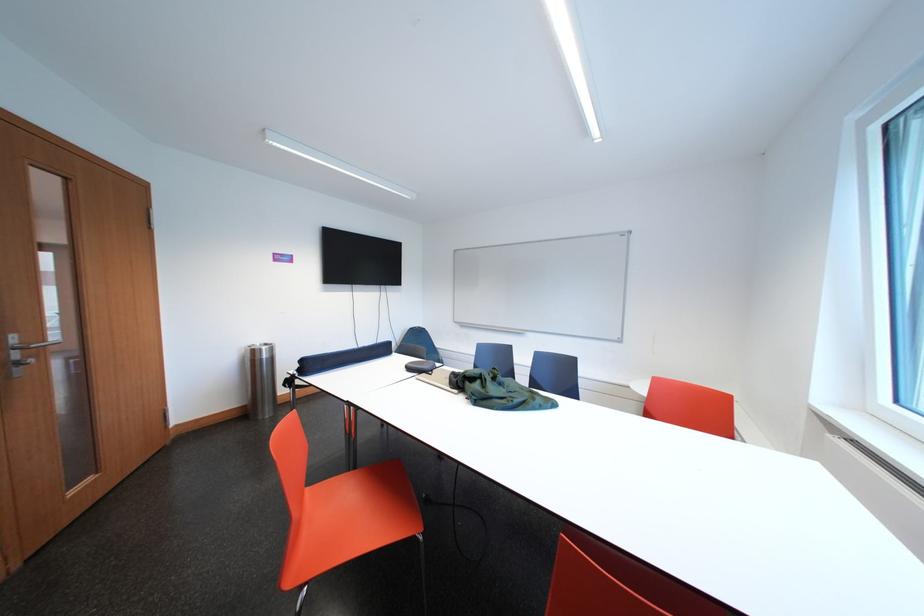
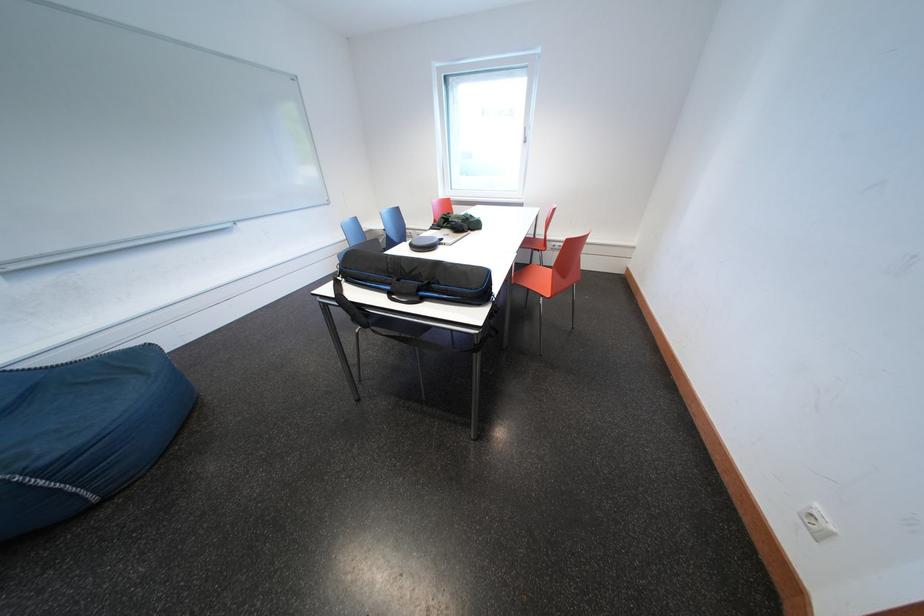
Question: I am providing you with two images of the same scene from different viewpoints. Please identify which objects are invisible in image2.

Choices:
 (A) whiteboard marker tray
 (B) large brown bottle
 (C) white window handle
 (D) long blue object

Answer: (D)